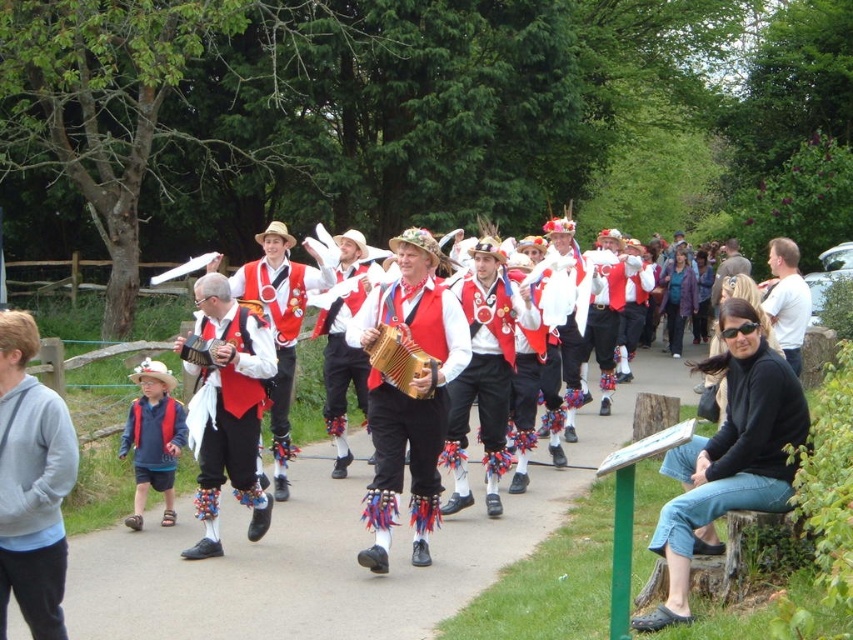
Question: Among these objects, which one is farthest from the camera?

Choices:
 (A) gray fleece sweatshirt at left
 (B) blue denim shorts at left
 (C) white cotton shirt at upper center

Answer: (C)

Question: Does gray fleece sweatshirt at left have a larger size compared to matte wooden accordion at center?

Choices:
 (A) yes
 (B) no

Answer: (A)

Question: Is gray fleece sweatshirt at left closer to camera compared to gold wooden accordion at center?

Choices:
 (A) yes
 (B) no

Answer: (A)

Question: Is black matte jacket at lower right positioned in front of matte wooden accordion at center?

Choices:
 (A) yes
 (B) no

Answer: (A)

Question: Which object is closer to the camera taking this photo?

Choices:
 (A) matte wooden accordion at center
 (B) black matte jacket at lower right

Answer: (B)

Question: Which object is positioned closest to the black matte jacket at lower right?

Choices:
 (A) white cotton shirt at upper center
 (B) matte wooden accordion at center

Answer: (B)